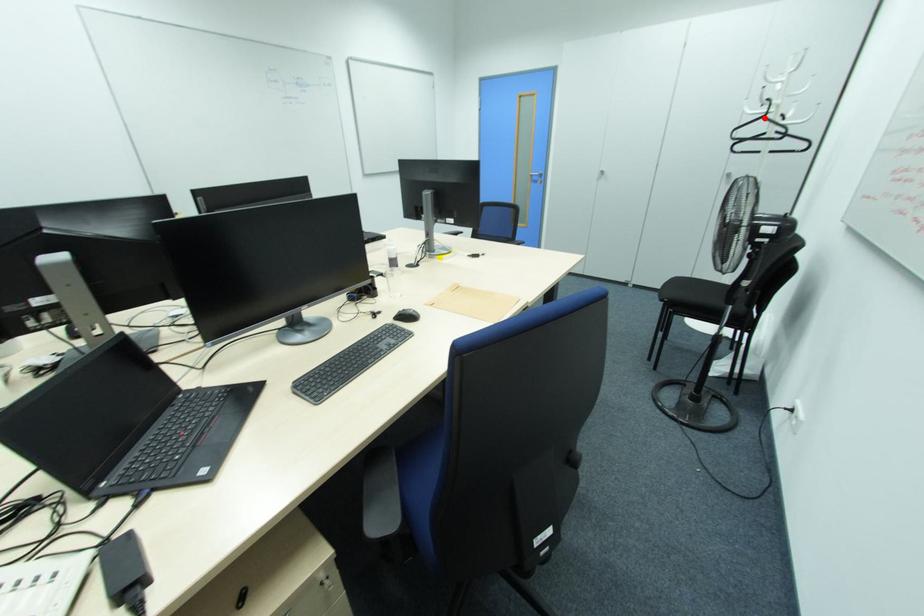
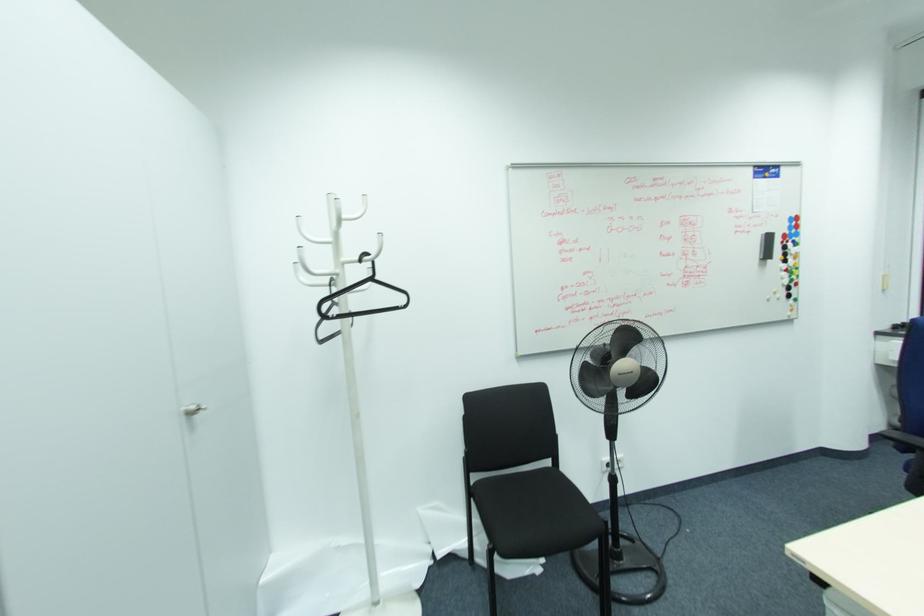
In the second image, find the point that corresponds to the highlighted location in the first image.

(371, 280)